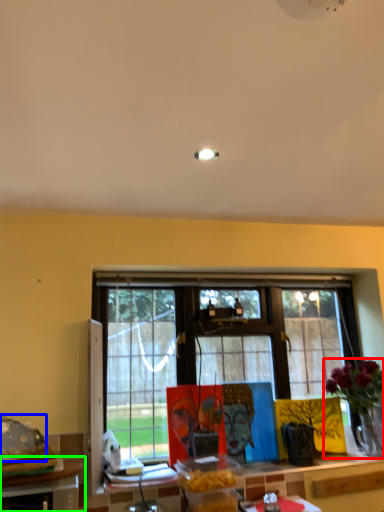
Question: Estimate the real-world distances between objects in this image. Which object is farther from houseplant (highlighted by a red box), food (highlighted by a blue box) or table (highlighted by a green box)?

Choices:
 (A) food
 (B) table

Answer: (A)